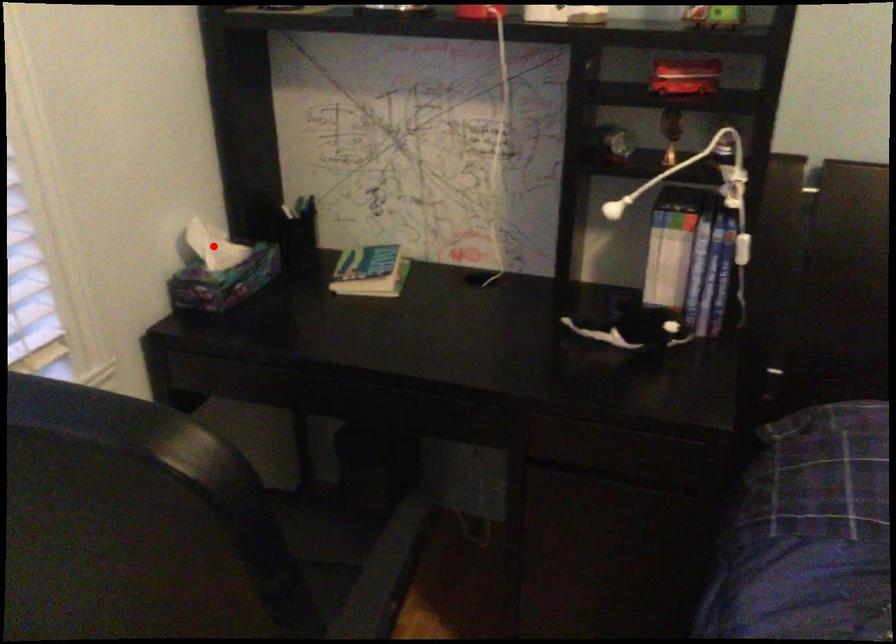
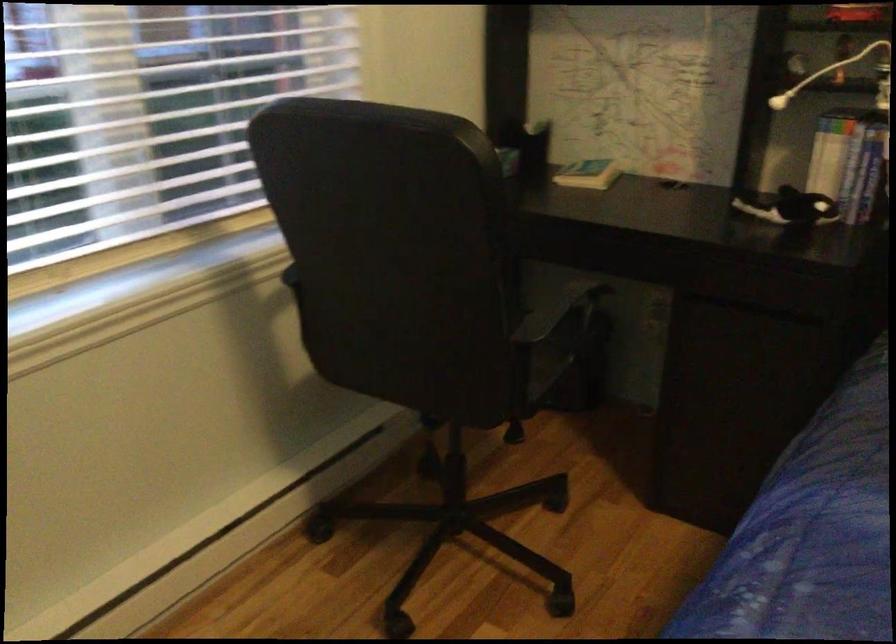
Question: I am providing you with two images of the same scene from different viewpoints. A red point is marked on the first image. At the location where the point appears in image 1, is it still visible in image 2?

Choices:
 (A) Yes
 (B) No

Answer: (B)